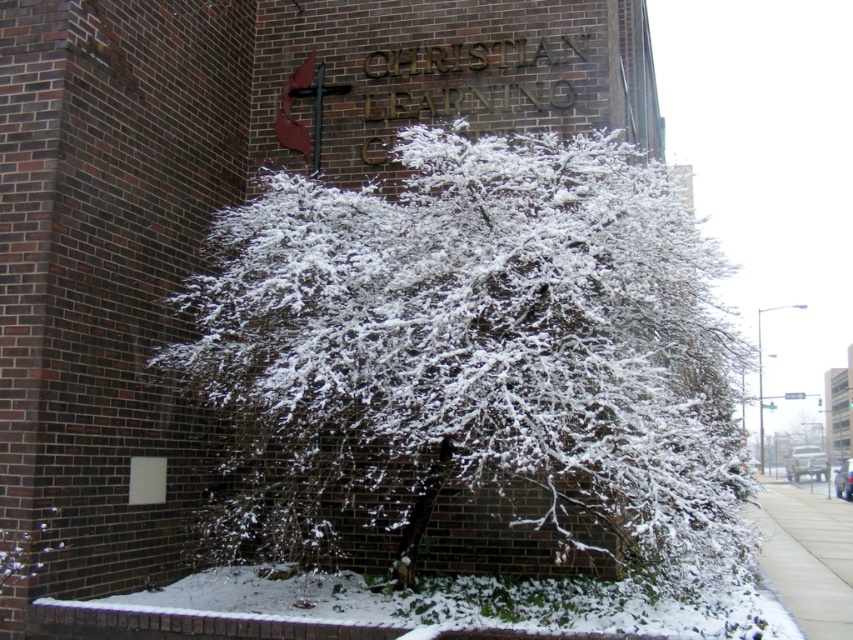
Does white snow-covered tree at center appear on the left side of concrete sidewalk at lower right?

Indeed, white snow-covered tree at center is positioned on the left side of concrete sidewalk at lower right.

The width and height of the screenshot is (853, 640). I want to click on white snow-covered tree at center, so click(x=469, y=358).